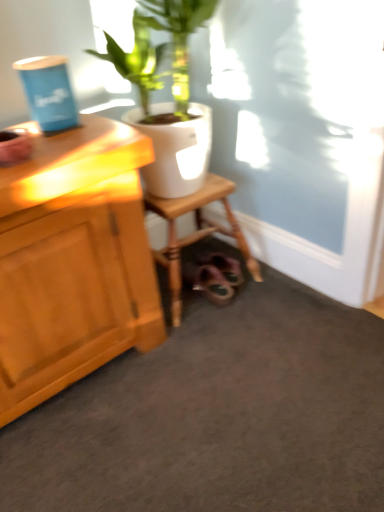
Where is `vacant space to the right of wooden stool at lower center`? vacant space to the right of wooden stool at lower center is located at coordinates (290, 297).